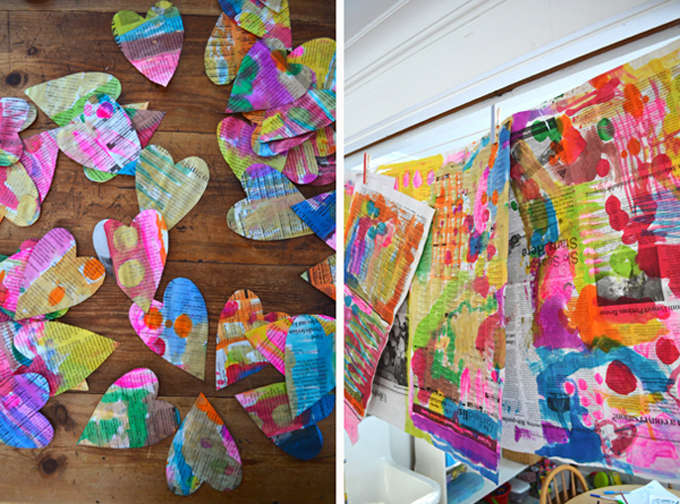
This screenshot has height=504, width=680. Find the location of `ceiling`. ceiling is located at coordinates (375, 2).